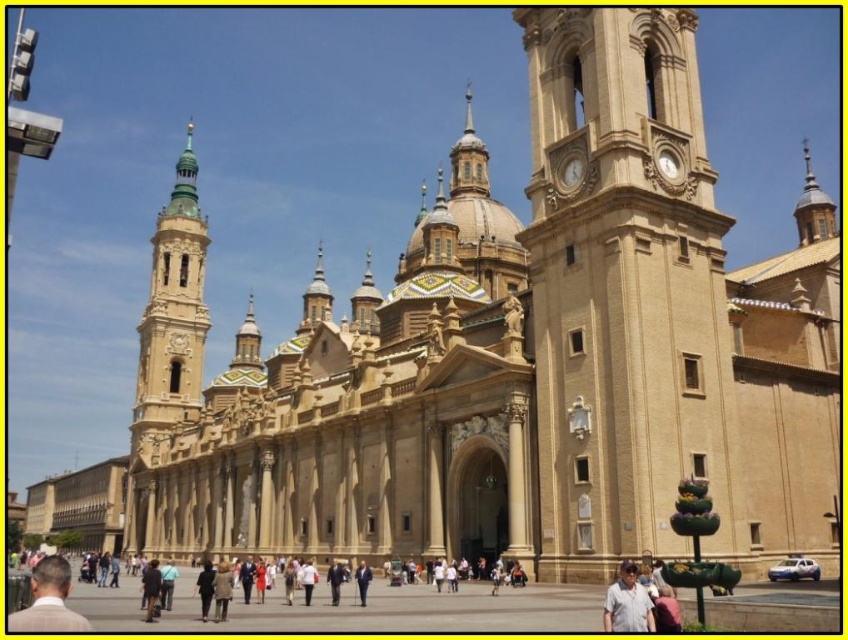
Question: Considering the relative positions of green glazed tile tower at upper left and light brown suit at lower left in the image provided, where is green glazed tile tower at upper left located with respect to light brown suit at lower left?

Choices:
 (A) right
 (B) left

Answer: (B)

Question: Does light brown suit at lower left appear over light gray shirt at center?

Choices:
 (A) yes
 (B) no

Answer: (B)

Question: Which object is farther from the camera taking this photo?

Choices:
 (A) light brown suit at lower left
 (B) green glazed tile tower at upper left

Answer: (B)

Question: Which object is farther from the camera taking this photo?

Choices:
 (A) light brown suit at lower left
 (B) green glazed tile tower at upper left

Answer: (B)

Question: Which point appears closest to the camera in this image?

Choices:
 (A) (612, 630)
 (B) (177, 403)
 (C) (662, 374)
 (D) (365, 589)

Answer: (A)

Question: Can you confirm if green glazed tile tower at upper left is bigger than light gray shirt at center?

Choices:
 (A) yes
 (B) no

Answer: (A)